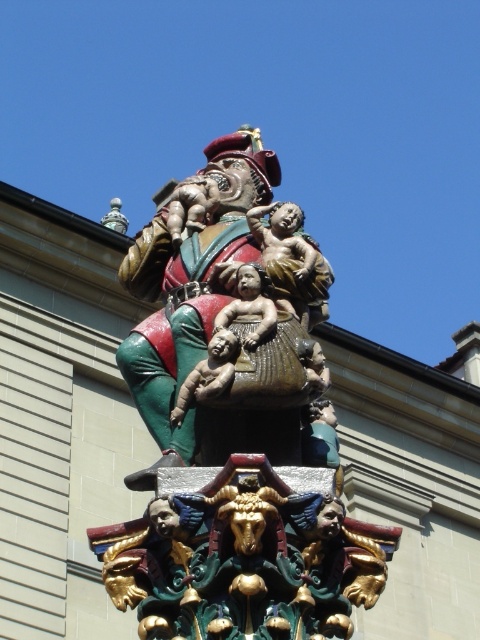
Which is more to the right, polychrome wood carving at center or bronze statue at center?

polychrome wood carving at center

Does point (217, 604) come farther from viewer compared to point (310, 321)?

No, it is in front of (310, 321).

The width and height of the screenshot is (480, 640). In order to click on polychrome wood carving at center in this screenshot , I will do `click(237, 422)`.

I want to click on polychrome wood carving at center, so click(x=237, y=422).

Does point (274, 275) come in front of point (215, 346)?

No, (274, 275) is behind (215, 346).

Where is `polychrome wood carving at center`? polychrome wood carving at center is located at coordinates (x=237, y=422).

Which of these two, bronze statue at center or matte brown baby at center, stands shorter?

matte brown baby at center

Does bronze statue at center have a larger size compared to matte brown baby at center?

Indeed, bronze statue at center has a larger size compared to matte brown baby at center.

Locate an element on the screen. This screenshot has width=480, height=640. bronze statue at center is located at coordinates (226, 316).